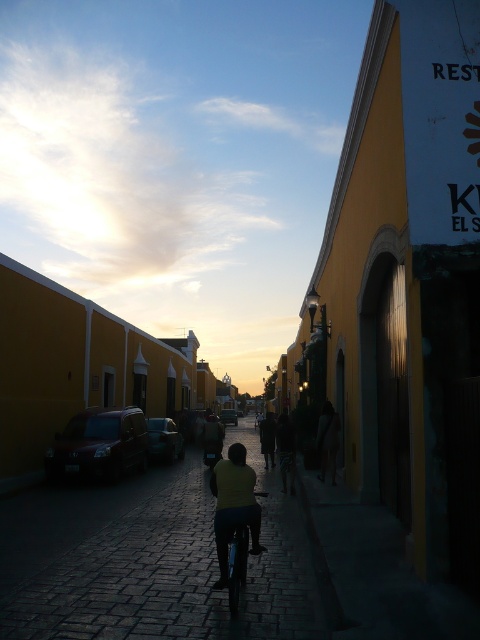
Question: From the image, what is the correct spatial relationship of dark yellow shirt at center in relation to dark fabric bag at center?

Choices:
 (A) above
 (B) below

Answer: (A)

Question: Which point is closer to the camera?

Choices:
 (A) dark fabric bag at center
 (B) dark yellow shirt at center
 (C) dark cobblestone alley at center

Answer: (C)

Question: Which point is farther from the camera taking this photo?

Choices:
 (A) (146, 636)
 (B) (324, 440)
 (C) (232, 476)

Answer: (B)

Question: Is dark yellow shirt at center behind dark fabric bag at center?

Choices:
 (A) yes
 (B) no

Answer: (B)

Question: Estimate the real-world distances between objects in this image. Which object is closer to the dark fabric bag at center?

Choices:
 (A) dark yellow shirt at center
 (B) dark cobblestone alley at center

Answer: (B)

Question: Is dark cobblestone alley at center bigger than dark fabric bag at center?

Choices:
 (A) no
 (B) yes

Answer: (B)